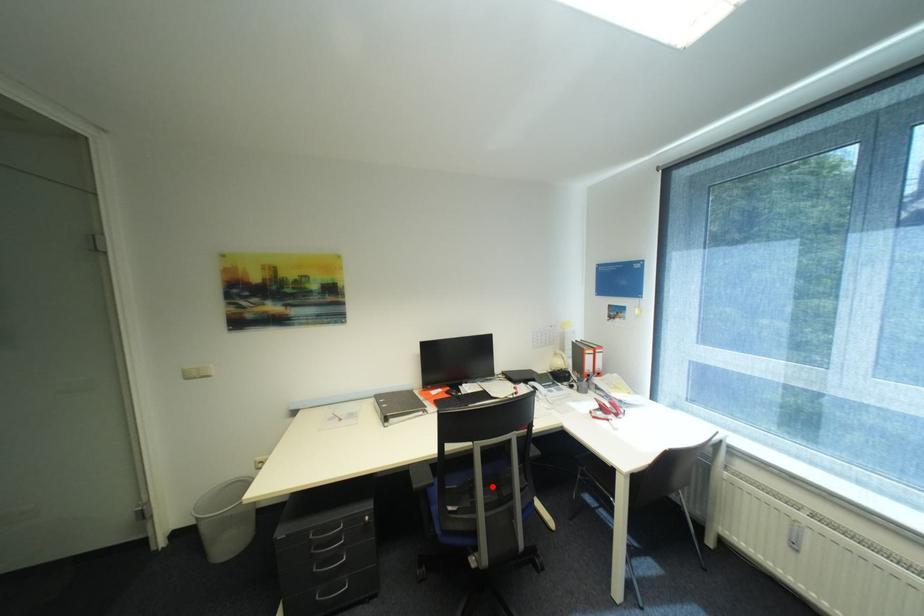
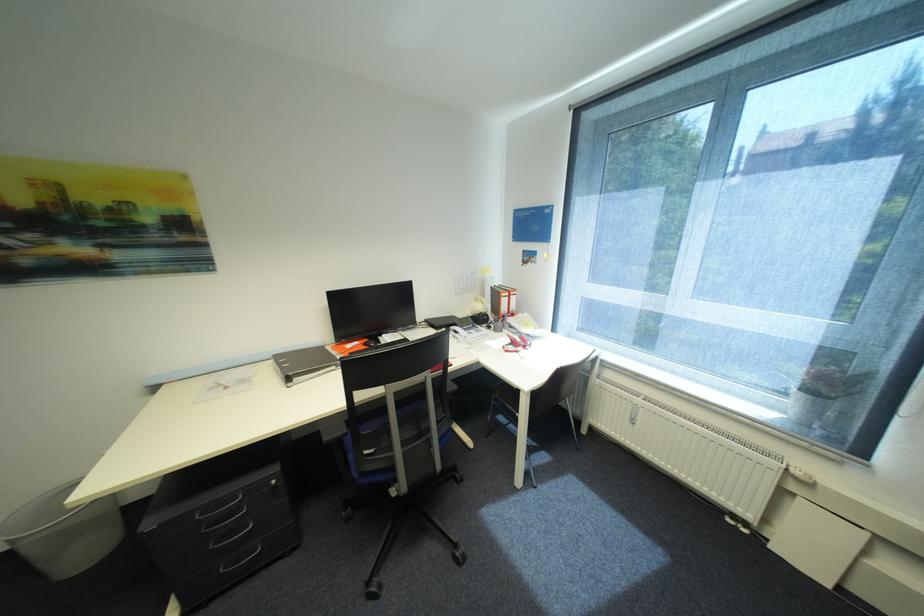
In the second image, find the point that corresponds to the highlighted location in the first image.

(407, 426)